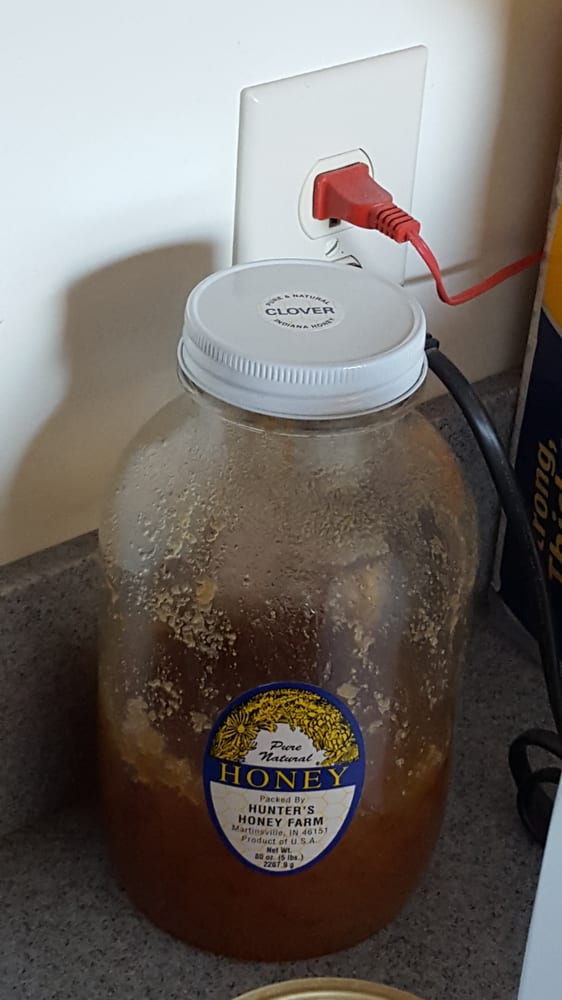
Find the location of a particular element. cord is located at coordinates (527, 817).